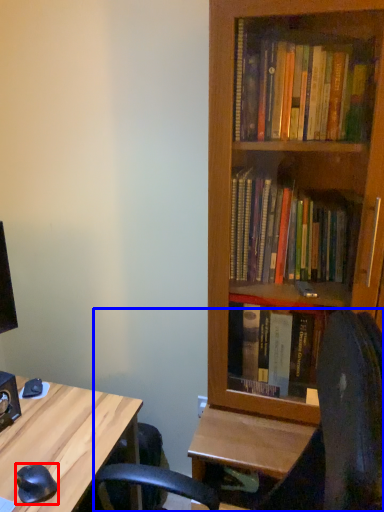
Question: Among these objects, which one is farthest to the camera, mouse (highlighted by a red box) or computer chair (highlighted by a blue box)?

Choices:
 (A) mouse
 (B) computer chair

Answer: (A)